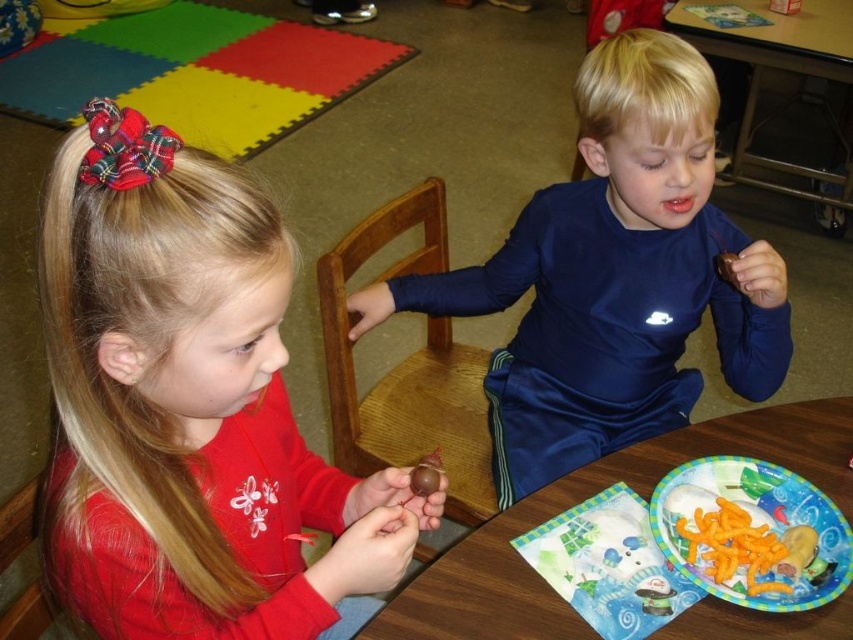
Is matte red shirt at center thinner than paper plate at lower center?

Correct, matte red shirt at center's width is less than paper plate at lower center's.

Consider the image. Is matte red shirt at center bigger than paper plate at lower center?

Correct, matte red shirt at center is larger in size than paper plate at lower center.

The width and height of the screenshot is (853, 640). Identify the location of matte red shirt at center. (189, 406).

Find the location of a particular element. matte red shirt at center is located at coordinates (189, 406).

Does point (703, 548) come in front of point (843, 198)?

Yes, point (703, 548) is in front of point (843, 198).

Is paper plate with colorful design at lower right bigger than wooden table at center?

No.

Does point (766, 600) come closer to viewer compared to point (815, 196)?

Yes, it is.

The image size is (853, 640). Find the location of `paper plate with colorful design at lower right`. paper plate with colorful design at lower right is located at coordinates (750, 531).

Can you confirm if shiny blue shirt at center is smaller than wooden table at center?

Indeed, shiny blue shirt at center has a smaller size compared to wooden table at center.

Who is shorter, shiny blue shirt at center or wooden table at center?

shiny blue shirt at center is shorter.

This screenshot has width=853, height=640. Identify the location of shiny blue shirt at center. click(x=613, y=276).